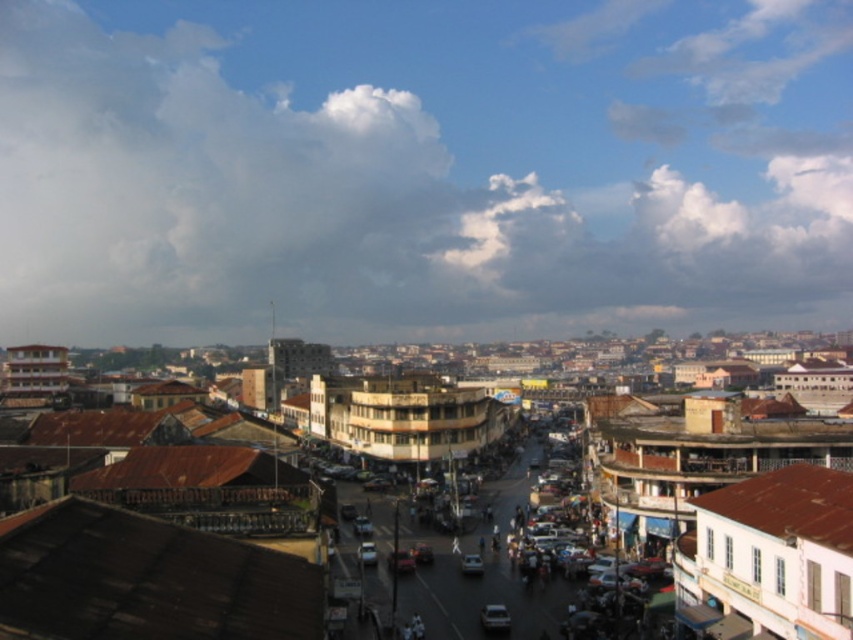
Can you confirm if white fluffy cloud at upper center is smaller than metallic silver car at center?

No, white fluffy cloud at upper center is not smaller than metallic silver car at center.

Who is lower down, white fluffy cloud at upper center or metallic silver car at center?

Positioned lower is metallic silver car at center.

You are a GUI agent. You are given a task and a screenshot of the screen. Output one action in this format:
    pyautogui.click(x=<x>, y=<y>)
    Task: Click on the white fluffy cloud at upper center
    The height and width of the screenshot is (640, 853).
    Given the screenshot: What is the action you would take?
    pyautogui.click(x=421, y=168)

Identify the location of white fluffy cloud at upper center. (421, 168).

Is point (276, 76) positioned in front of point (111, 570)?

No, (276, 76) is further to viewer.

Does white fluffy cloud at upper center have a greater height compared to brown corrugated metal roofs at center?

Indeed, white fluffy cloud at upper center has a greater height compared to brown corrugated metal roofs at center.

This screenshot has width=853, height=640. What do you see at coordinates (421, 168) in the screenshot? I see `white fluffy cloud at upper center` at bounding box center [421, 168].

Find the location of `white fluffy cloud at upper center`. white fluffy cloud at upper center is located at coordinates (421, 168).

Consider the image. Is brown corrugated metal roofs at center in front of metallic silver car at center?

Yes.

Is brown corrugated metal roofs at center to the left of metallic silver car at center from the viewer's perspective?

Yes, brown corrugated metal roofs at center is to the left of metallic silver car at center.

Where is `brown corrugated metal roofs at center`? brown corrugated metal roofs at center is located at coordinates (160, 554).

Where is `brown corrugated metal roofs at center`? The image size is (853, 640). brown corrugated metal roofs at center is located at coordinates (160, 554).